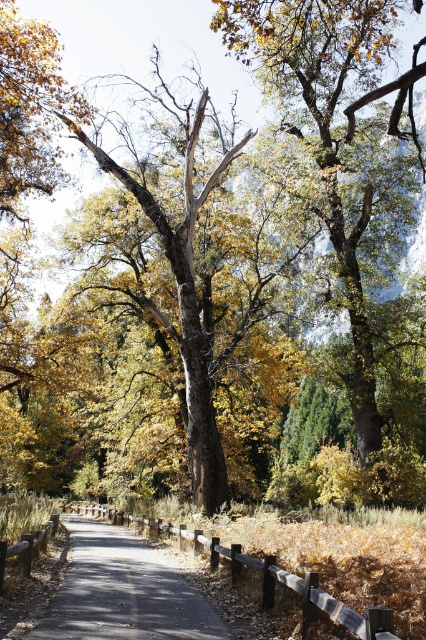
You are a hiker standing on the smooth asphalt path at center. You want to take a photo of the green leafy tree at center. Which direction should you face to ensure the tree is in the foreground of your photo?

You should face away from the green leafy tree at center because the smooth asphalt path at center is behind it, so the tree will be in the foreground.

You are a hiker who wants to take a photo of the green leafy tree at center and the smooth asphalt path at center. To ensure both are fully visible in your shot, which object should you position closer to the camera?

The green leafy tree at center might be wider than the smooth asphalt path at center, so to ensure both are fully visible, you should position the smooth asphalt path at center closer to the camera.